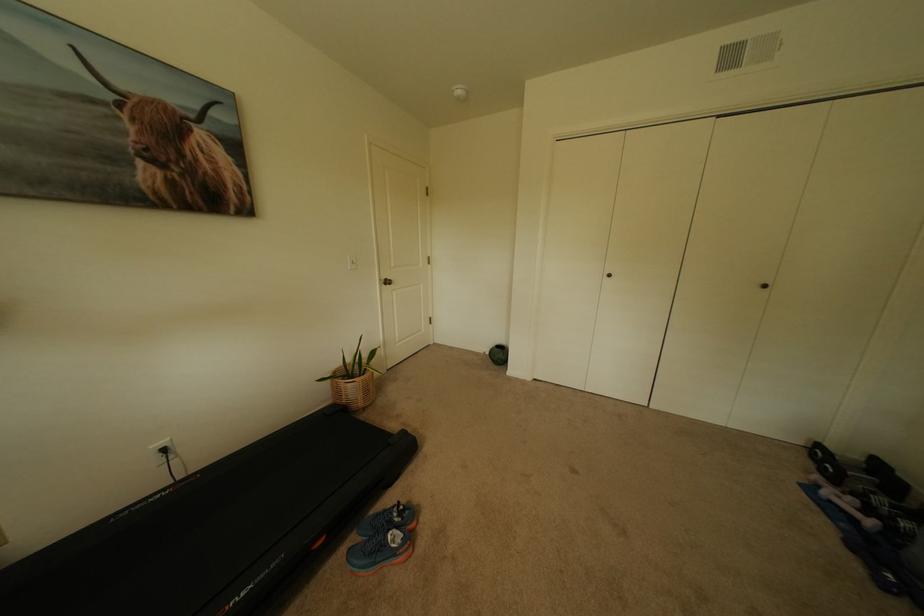
This screenshot has height=616, width=924. Describe the element at coordinates (386, 281) in the screenshot. I see `the silver doorknob` at that location.